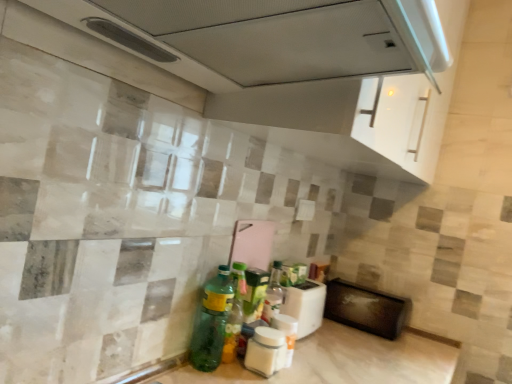
Question: Considering the positions of black matte microwave at lower right, positioned as the 2th appliance in front-to-back order, and white matte jar at center, the 2th bottle from the right, in the image, is black matte microwave at lower right, positioned as the 2th appliance in front-to-back order, wider or thinner than white matte jar at center, the 2th bottle from the right,?

Choices:
 (A) wide
 (B) thin

Answer: (A)

Question: Considering their positions, is black matte microwave at lower right, which ranks as the first appliance in right-to-left order, located in front of or behind white matte jar at center, the 2th bottle from the right?

Choices:
 (A) front
 (B) behind

Answer: (B)

Question: Considering the real-world distances, which object is farthest from the black matte microwave at lower right, which ranks as the first appliance in right-to-left order?

Choices:
 (A) white plastic toaster at lower center, placed as the first appliance when sorted from left to right
 (B) green glass bottle at lower center, the 1th bottle positioned from the left
 (C) white glossy exhaust hood at upper center
 (D) white matte jar at center, the 2th bottle from the right
 (E) translucent plastic bottle at center, acting as the third bottle starting from the left

Answer: (C)

Question: Estimate the real-world distances between objects in this image. Which object is farther from the green glass bottle at lower center, which is the 3th bottle in right-to-left order?

Choices:
 (A) black matte microwave at lower right, positioned as the 2th appliance in front-to-back order
 (B) white glossy exhaust hood at upper center
 (C) translucent plastic bottle at center, acting as the third bottle starting from the left
 (D) white matte jar at center, the 2th bottle from the right
 (E) white plastic toaster at lower center, placed as the first appliance when sorted from left to right

Answer: (A)